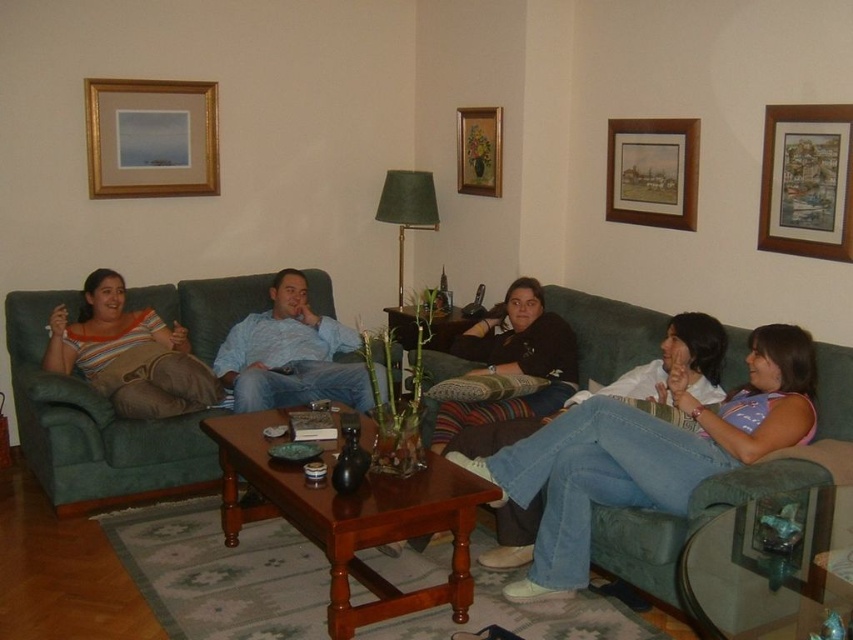
Is gold wooden picture frame at upper center wider than matte blue shirt at center?

Incorrect, gold wooden picture frame at upper center's width does not surpass matte blue shirt at center's.

Does gold wooden picture frame at upper center appear on the left side of matte blue shirt at center?

Indeed, gold wooden picture frame at upper center is positioned on the left side of matte blue shirt at center.

Is point (105, 104) more distant than point (334, 362)?

Yes, it is.

The image size is (853, 640). I want to click on gold wooden picture frame at upper center, so click(151, 138).

Is striped cotton shirt at center taller than matte blue shirt at center?

No, striped cotton shirt at center is not taller than matte blue shirt at center.

Is striped cotton shirt at center to the right of matte blue shirt at center from the viewer's perspective?

No, striped cotton shirt at center is not to the right of matte blue shirt at center.

Between point (115, 323) and point (287, 401), which one is positioned in front?

Point (287, 401) is more forward.

Locate an element on the screen. The height and width of the screenshot is (640, 853). striped cotton shirt at center is located at coordinates (129, 355).

Does gold wooden picture frame at upper center appear on the right side of wooden framed artwork at upper right?

Incorrect, gold wooden picture frame at upper center is not on the right side of wooden framed artwork at upper right.

Who is more distant from viewer, [213,108] or [785,230]?

Point [213,108]

At what (x,y) coordinates should I click in order to perform the action: click on gold wooden picture frame at upper center. Please return your answer as a coordinate pair (x, y). Looking at the image, I should click on (151, 138).